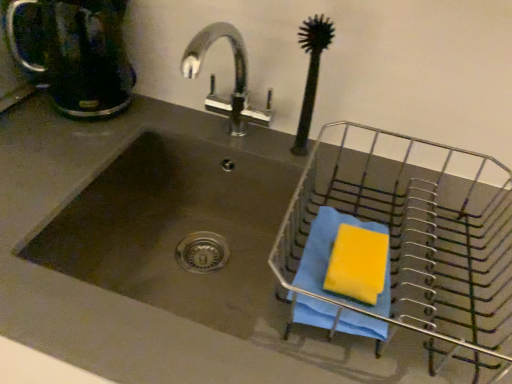
Question: From the image's perspective, is matte black coffeepot at upper left on metallic wire basket at right?

Choices:
 (A) no
 (B) yes

Answer: (B)

Question: From the image's perspective, would you say matte black coffeepot at upper left is shown under metallic wire basket at right?

Choices:
 (A) no
 (B) yes

Answer: (A)

Question: Is matte black coffeepot at upper left at the left side of metallic wire basket at right?

Choices:
 (A) yes
 (B) no

Answer: (A)

Question: Considering the relative sizes of matte black coffeepot at upper left and metallic wire basket at right in the image provided, is matte black coffeepot at upper left wider than metallic wire basket at right?

Choices:
 (A) yes
 (B) no

Answer: (B)

Question: Can you confirm if matte black coffeepot at upper left is bigger than metallic wire basket at right?

Choices:
 (A) yes
 (B) no

Answer: (B)

Question: From a real-world perspective, is matte black coffeepot at upper left positioned above or below blue cloth at right?

Choices:
 (A) above
 (B) below

Answer: (A)

Question: Relative to blue cloth at right, is matte black coffeepot at upper left in front or behind?

Choices:
 (A) behind
 (B) front

Answer: (A)

Question: Is point (122, 8) positioned closer to the camera than point (294, 274)?

Choices:
 (A) closer
 (B) farther

Answer: (B)

Question: Visually, is matte black coffeepot at upper left positioned to the left or to the right of blue cloth at right?

Choices:
 (A) right
 (B) left

Answer: (B)

Question: Considering the positions of black rubber brush at upper right and yellow sponge at right in the image, is black rubber brush at upper right taller or shorter than yellow sponge at right?

Choices:
 (A) short
 (B) tall

Answer: (B)

Question: From a real-world perspective, is black rubber brush at upper right positioned above or below yellow sponge at right?

Choices:
 (A) below
 (B) above

Answer: (B)

Question: From the image's perspective, is black rubber brush at upper right located above or below yellow sponge at right?

Choices:
 (A) above
 (B) below

Answer: (A)

Question: Is black rubber brush at upper right inside or outside of yellow sponge at right?

Choices:
 (A) outside
 (B) inside

Answer: (A)

Question: From a real-world perspective, is matte black coffeepot at upper left above or below metallic wire basket at right?

Choices:
 (A) above
 (B) below

Answer: (A)

Question: Is matte black coffeepot at upper left in front of or behind metallic wire basket at right in the image?

Choices:
 (A) behind
 (B) front

Answer: (A)